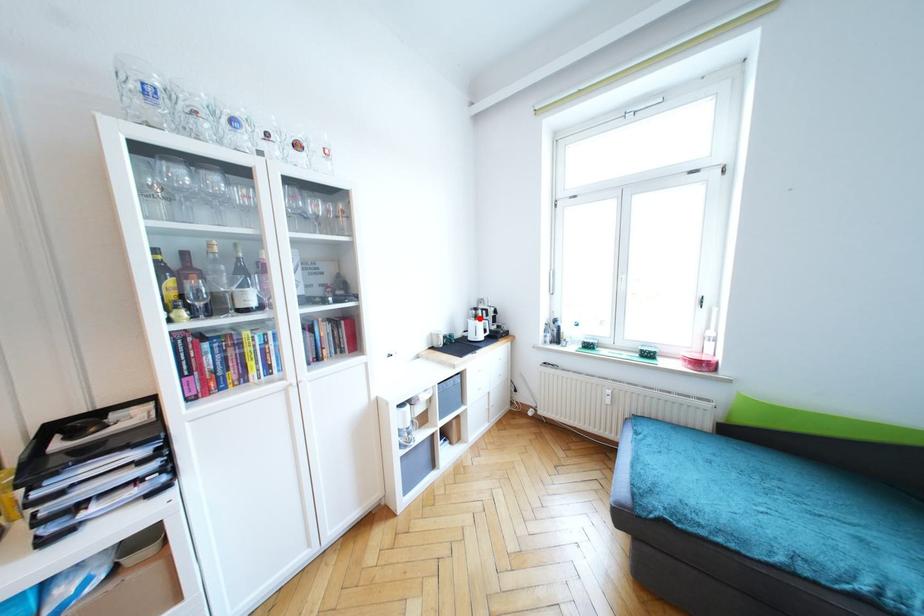
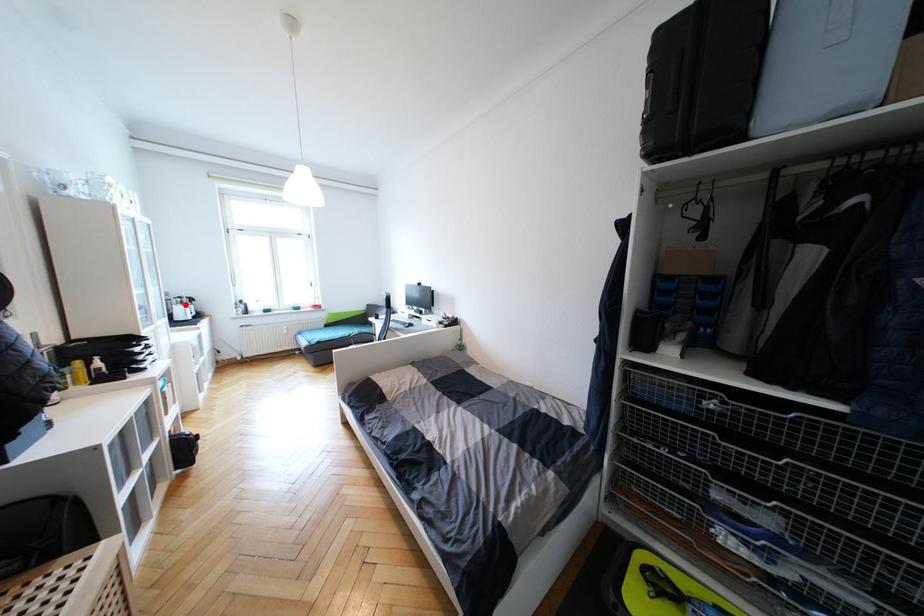
I am providing you with two images of the same scene from different viewpoints. A red point is marked on the first image and another point is marked on the second image. Are the points marked in image1 and image2 representing the same 3D position?

Yes